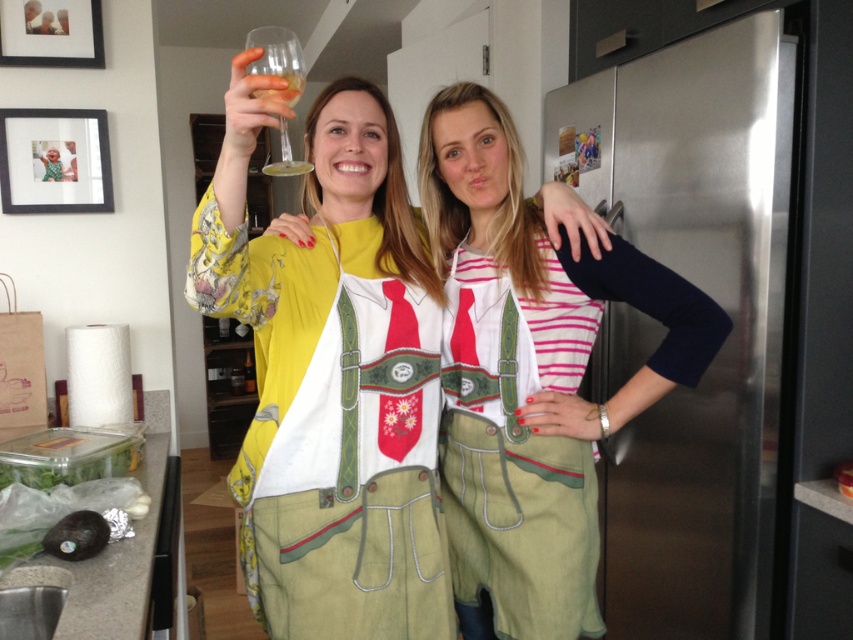
Which is behind, point (468, 561) or point (294, 84)?

Positioned behind is point (468, 561).

Looking at this image, does green fabric apron at center appear over translucent glass at upper center?

Actually, green fabric apron at center is below translucent glass at upper center.

Measure the distance between green fabric apron at center and camera.

green fabric apron at center and camera are 1.19 meters apart.

Identify the location of green fabric apron at center. (531, 376).

Describe the element at coordinates (318, 333) in the screenshot. I see `matte yellow blouse at center` at that location.

Between point (392, 150) and point (351, 563), which one is positioned in front?

Positioned in front is point (351, 563).

Find the location of a particular element. The image size is (853, 640). matte yellow blouse at center is located at coordinates (318, 333).

From the picture: Is the position of matte yellow blouse at center less distant than that of translucent glass at upper center?

Yes, it is.

Which of these two, matte yellow blouse at center or translucent glass at upper center, stands taller?

Standing taller between the two is matte yellow blouse at center.

Which is behind, point (314, 477) or point (288, 84)?

The point (314, 477) is behind.

This screenshot has height=640, width=853. I want to click on matte yellow blouse at center, so click(318, 333).